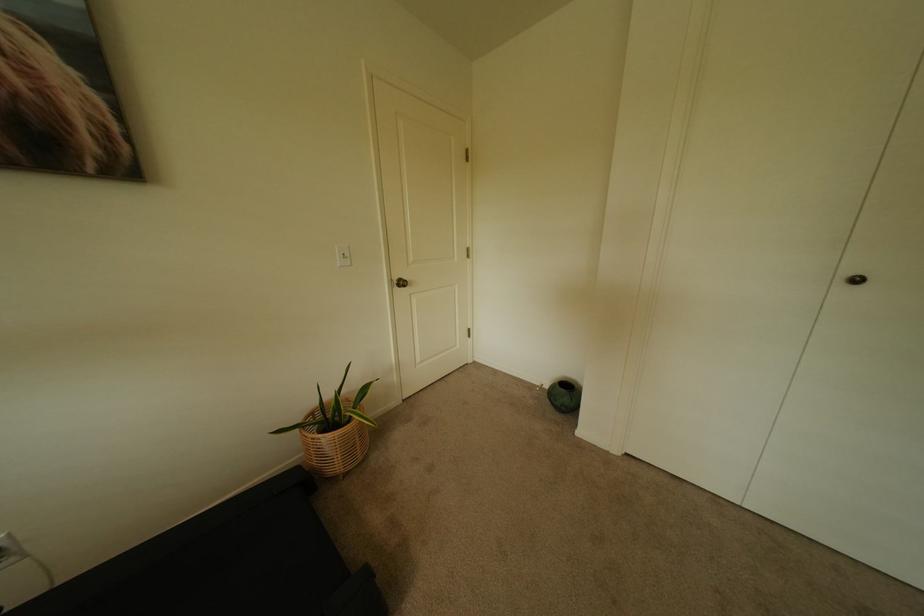
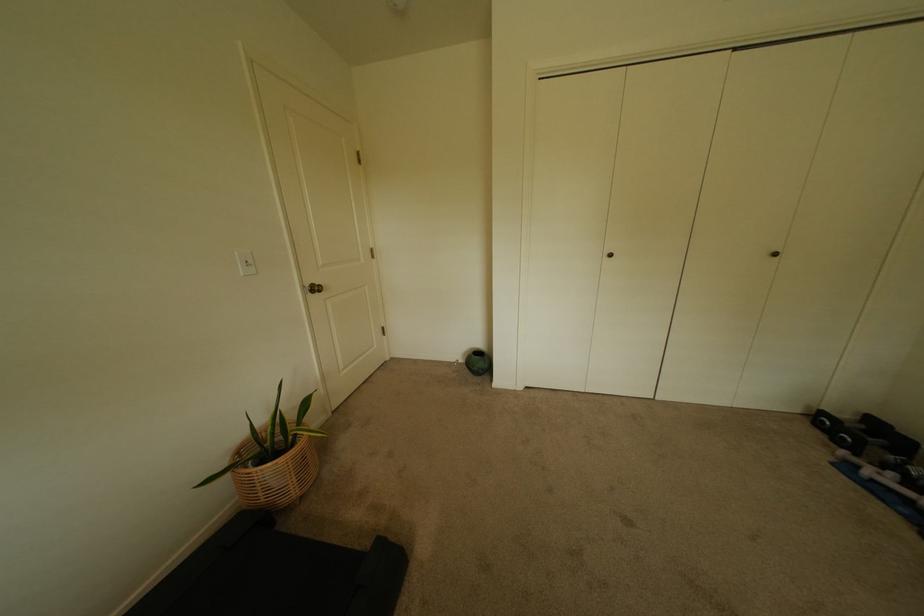
In the second image, find the point that corresponds to point (866, 282) in the first image.

(618, 256)